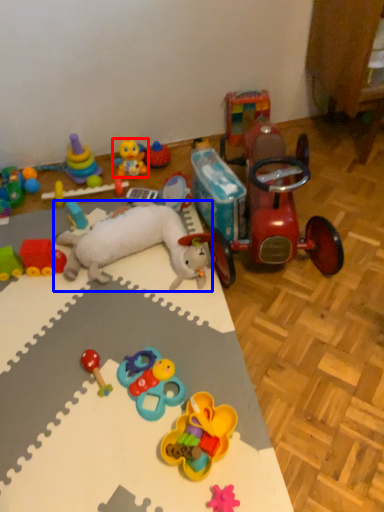
Question: Which object appears closest to the camera in this image, toy (highlighted by a red box) or toy (highlighted by a blue box)?

Choices:
 (A) toy
 (B) toy

Answer: (B)